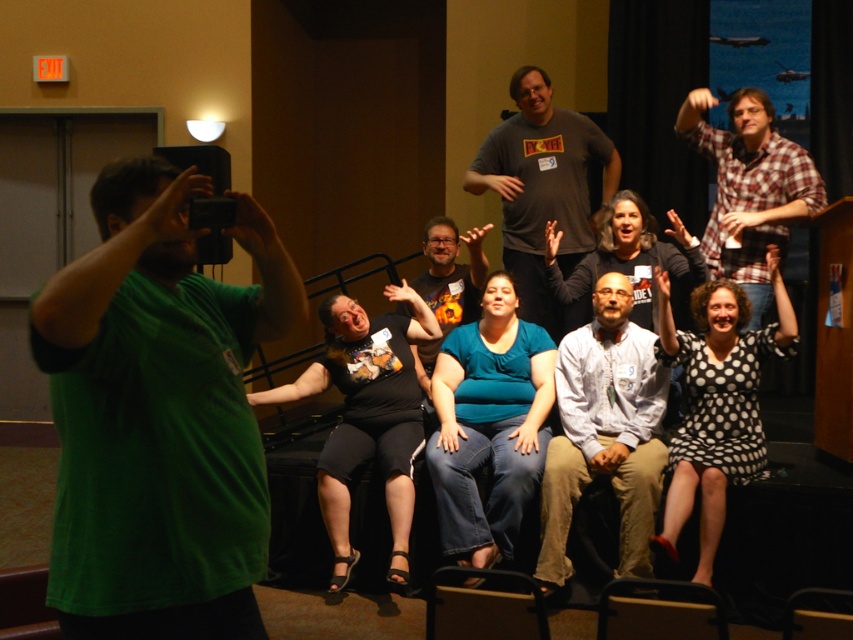
You are standing in the conference room and want to take a photo of the group on the stage. The photographer with the green matte shirt at left is in your way. Can you walk around them to get a better angle? Please explain why or why not based on the distance between them and you.

The distance between the green matte shirt at left and the viewer is 1.60 meters. Since the photographer is only 1.60 meters away from you, you can easily walk around them to get a better angle as the distance is manageable for maneuvering around the person.

You are a photographer standing at the back of the room. You need to take a photo of both the green matte shirt at left and the matte black shirt at center. The camera you have can only focus on objects within a 3 meter range. Will both subjects be within the camera range?

The distance between the green matte shirt at left and the matte black shirt at center is 2.99 meters, which is within the 3 meter range. Therefore, both subjects will be within the camera range.

You are standing in the conference room and want to take a photo of the teal matte shirt at center and the plaid flannel shirt at upper right. Which one will appear larger in your photo?

The teal matte shirt at center will appear larger in the photo because it is closer to the viewer than the plaid flannel shirt at upper right.